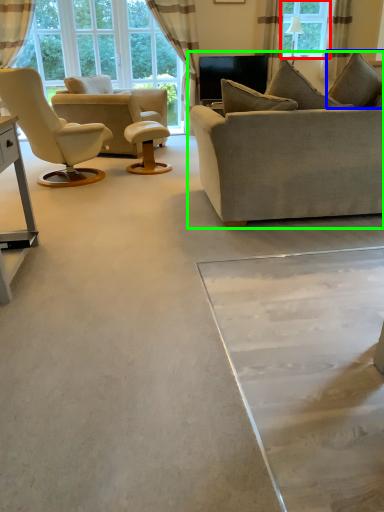
Question: Which object is the closest to the window (highlighted by a red box)? Choose among these: pillow (highlighted by a blue box) or studio couch (highlighted by a green box).

Choices:
 (A) pillow
 (B) studio couch

Answer: (A)